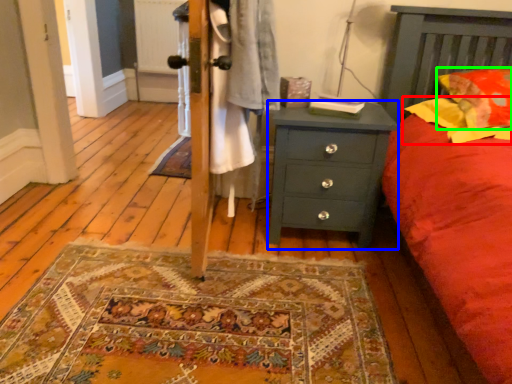
Question: Estimate the real-world distances between objects in this image. Which object is farther from pillow (highlighted by a red box), chest of drawers (highlighted by a blue box) or pillow (highlighted by a green box)?

Choices:
 (A) chest of drawers
 (B) pillow

Answer: (A)